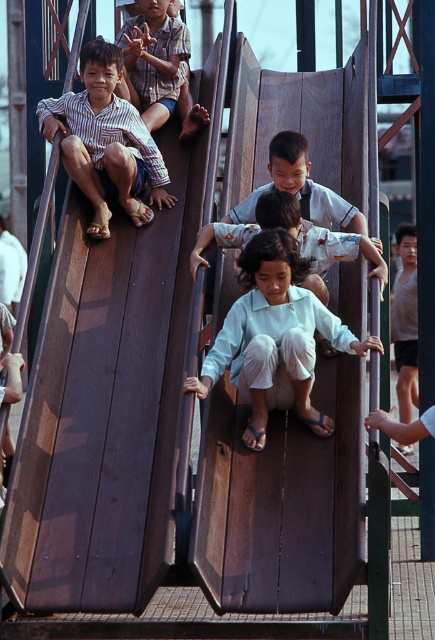
Question: Is light blue fabric pants at center bigger than striped cotton shirt at upper left?

Choices:
 (A) no
 (B) yes

Answer: (B)

Question: Which of these objects is positioned farthest from the light blue shirt at center?

Choices:
 (A) matte striped shirt at left
 (B) striped cotton shirt at upper left
 (C) smooth white shirt at center
 (D) light blue fabric pants at center

Answer: (B)

Question: Based on their relative distances, which object is farther from the striped cotton shirt at upper left?

Choices:
 (A) smooth white shirt at center
 (B) light blue shirt at center

Answer: (B)

Question: Which object is positioned farthest from the striped cotton shirt at upper left?

Choices:
 (A) light blue shirt at center
 (B) matte striped shirt at left
 (C) smooth white shirt at center
 (D) light blue fabric pants at center

Answer: (D)

Question: Does striped cotton shirt at upper left appear on the right side of light blue shirt at center?

Choices:
 (A) no
 (B) yes

Answer: (A)

Question: Can you confirm if light blue fabric pants at center is thinner than light blue shirt at center?

Choices:
 (A) no
 (B) yes

Answer: (B)